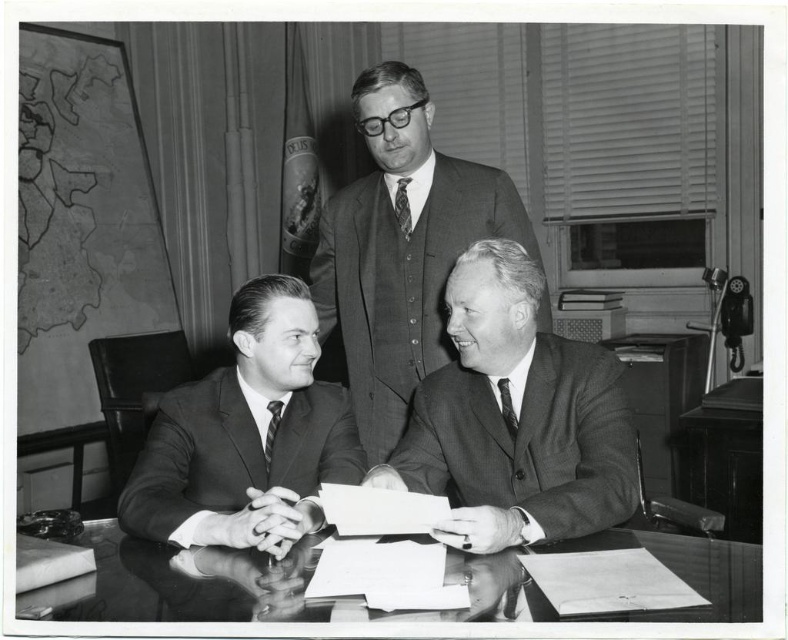
You are a tailor observing the image and need to adjust the striped silk tie at center and the smooth gray suit at center. Which item is positioned closer to the camera?

The striped silk tie at center is behind the smooth gray suit at center, so the smooth gray suit at center is closer to the camera.

Based on the scene described, which object is positioned closer to the observer? The smooth gray suit at center or the dark gray textured tie at center?

The smooth gray suit at center is closer to the observer because the dark gray textured tie at center is positioned behind it.

In the office scene, there are two men at a desk wearing a smooth gray suit at center and a striped silk tie at center. Which one has clothing that is taller?

The smooth gray suit at center is taller than the striped silk tie at center.